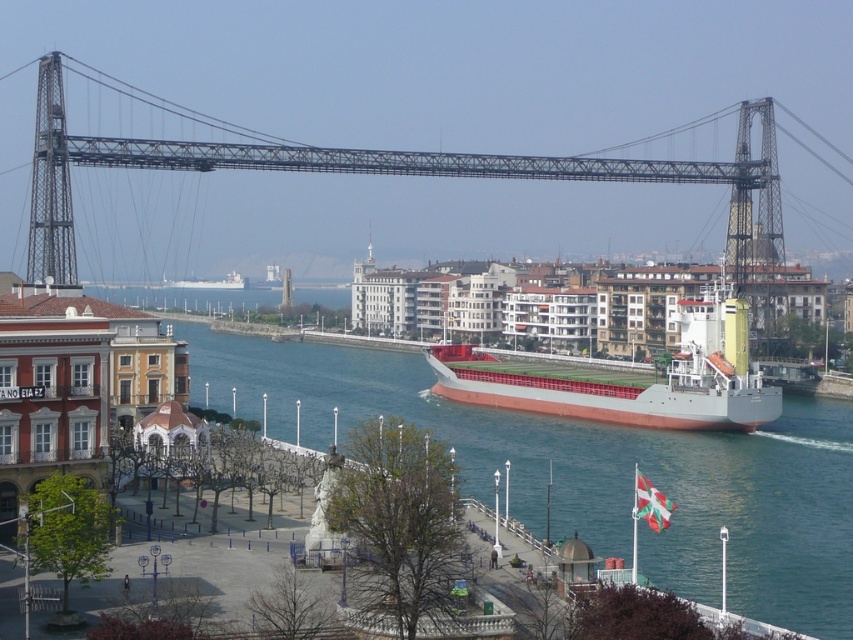
You are standing on the paved promenade and want to take a photo of the metallic suspension bridge at center. Which direction should you face to capture the bridge in your shot?

The metallic suspension bridge at center is located at point (402, 173), so you should face towards the center of the promenade to capture the bridge in your photo.

You are standing on the waterfront promenade and notice a specific point marked at coordinates point (402, 173). Based on the scene description, where is this point located?

The point (402, 173) is located on the metallic suspension bridge at center.

You are a photographer planning to capture a wide shot of the waterfront scene. You want to ensure both the metallic suspension bridge at center and the red matte cargo ship at center are clearly visible in the frame. Considering their sizes, which object will appear wider in your photograph?

The metallic suspension bridge at center will appear wider in the photograph because its width is larger than that of the red matte cargo ship at center according to the description.